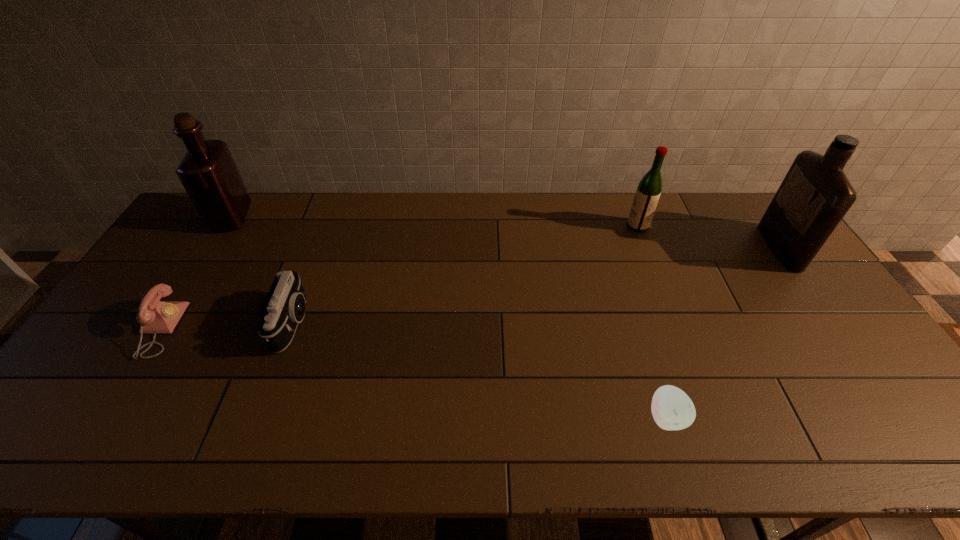
The height and width of the screenshot is (540, 960). I want to click on liquor that is at the left edge, so click(x=208, y=172).

Identify the location of telephone positioned at the left edge. The image size is (960, 540). (155, 316).

This screenshot has height=540, width=960. I want to click on object that is at the right edge, so click(x=815, y=195).

Where is `object that is at the far left corner`? Image resolution: width=960 pixels, height=540 pixels. object that is at the far left corner is located at coordinates (208, 172).

The height and width of the screenshot is (540, 960). Find the location of `object that is at the far right corner`. object that is at the far right corner is located at coordinates (815, 195).

At what (x,y) coordinates should I click in order to perform the action: click on vacant position at the far edge of the desktop. Please return your answer as a coordinate pair (x, y). Looking at the image, I should click on (536, 230).

This screenshot has width=960, height=540. I want to click on free space at the near edge of the desktop, so click(563, 435).

Where is `free space at the left edge of the desktop`? Image resolution: width=960 pixels, height=540 pixels. free space at the left edge of the desktop is located at coordinates (90, 393).

Locate an element on the screen. vacant point at the right edge is located at coordinates (837, 341).

Image resolution: width=960 pixels, height=540 pixels. In the image, there is a desktop. Identify the location of free region at the near left corner. click(103, 432).